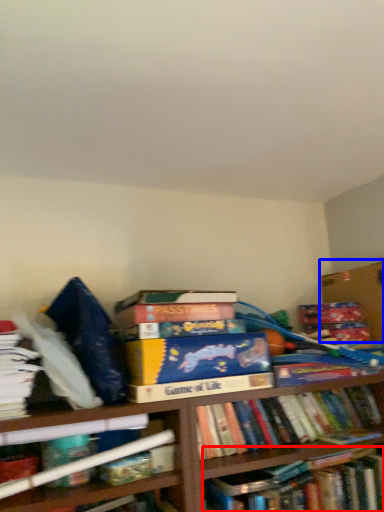
Question: Which object is further to the camera taking this photo, book (highlighted by a red box) or cardboard box (highlighted by a blue box)?

Choices:
 (A) book
 (B) cardboard box

Answer: (B)